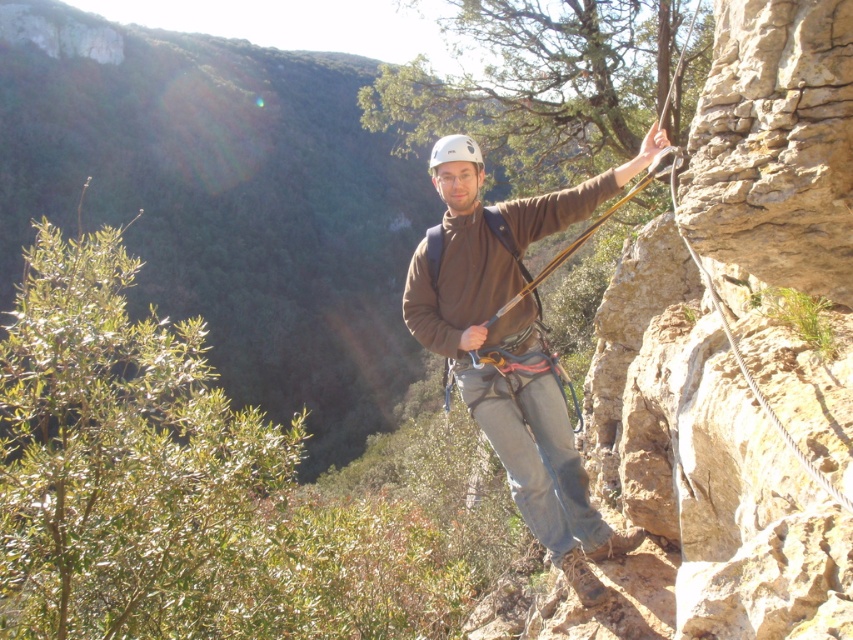
Question: Does brown fabric jacket at center appear over white matte helmet at center?

Choices:
 (A) no
 (B) yes

Answer: (A)

Question: Does brown fabric jacket at center lie behind white matte helmet at center?

Choices:
 (A) no
 (B) yes

Answer: (A)

Question: Is brown fabric jacket at center closer to the viewer compared to white matte helmet at center?

Choices:
 (A) yes
 (B) no

Answer: (A)

Question: Which point is closer to the camera taking this photo?

Choices:
 (A) (453, 204)
 (B) (508, 436)

Answer: (A)

Question: Among these points, which one is nearest to the camera?

Choices:
 (A) (437, 176)
 (B) (540, 515)

Answer: (A)

Question: Which object appears closest to the camera in this image?

Choices:
 (A) white matte helmet at center
 (B) brown fabric jacket at center

Answer: (B)